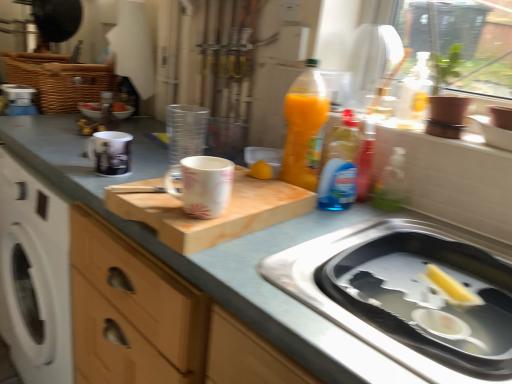
Measure the distance between point (39, 151) and camera.

The depth of point (39, 151) is 1.15 meters.

What do you see at coordinates (450, 288) in the screenshot?
I see `yellow rubber duck at sink right` at bounding box center [450, 288].

This screenshot has height=384, width=512. Describe the element at coordinates (106, 112) in the screenshot. I see `metallic silver bottle at upper center, which appears as the 1th bottle when viewed from the back` at that location.

Describe the element at coordinates (203, 185) in the screenshot. I see `pink floral ceramic mug at center, which ranks as the 1th mug in front-to-back order` at that location.

Locate an element on the screen. Image resolution: width=512 pixels, height=384 pixels. matte wooden cutting board at center is located at coordinates (214, 250).

From a real-world perspective, which is physically below, metallic silver bottle at upper center, marked as the 1th bottle in a top-to-bottom arrangement, or pink floral ceramic mug at center, which is counted as the 1th mug, starting from the right?

metallic silver bottle at upper center, marked as the 1th bottle in a top-to-bottom arrangement.

What's the angular difference between metallic silver bottle at upper center, positioned as the first bottle in left-to-right order, and pink floral ceramic mug at center, the second mug from the back,'s facing directions?

The angular difference between metallic silver bottle at upper center, positioned as the first bottle in left-to-right order, and pink floral ceramic mug at center, the second mug from the back, is 122 degrees.

Is metallic silver bottle at upper center, which ranks as the second bottle in front-to-back order, situated inside pink floral ceramic mug at center, which is counted as the 1th mug, starting from the right, or outside?

metallic silver bottle at upper center, which ranks as the second bottle in front-to-back order, is outside pink floral ceramic mug at center, which is counted as the 1th mug, starting from the right.

Is metallic silver bottle at upper center, positioned as the first bottle in left-to-right order, facing away from pink floral ceramic mug at center, which ranks as the 1th mug in front-to-back order?

No, metallic silver bottle at upper center, positioned as the first bottle in left-to-right order,'s orientation is not away from pink floral ceramic mug at center, which ranks as the 1th mug in front-to-back order.

Which of these two, wooden cutting board at center or matte white mug at upper left, the first mug when ordered from left to right, is wider?

With larger width is wooden cutting board at center.

Based on their positions, is wooden cutting board at center located to the left or right of matte white mug at upper left, which ranks as the first mug in back-to-front order?

wooden cutting board at center is to the right of matte white mug at upper left, which ranks as the first mug in back-to-front order.

Does point (210, 227) come behind point (123, 133)?

No, (210, 227) is in front of (123, 133).

From a real-world perspective, between wooden cutting board at center and matte white mug at upper left, which ranks as the first mug in back-to-front order, who is vertically higher?

matte white mug at upper left, which ranks as the first mug in back-to-front order, from a real-world perspective.

Where is `basket lying behind the matte wooden cutting board at center`? This screenshot has width=512, height=384. basket lying behind the matte wooden cutting board at center is located at coordinates (58, 79).

Looking at this image, how far apart are matte wooden cutting board at center and woven brown basket at upper left?

The distance of matte wooden cutting board at center from woven brown basket at upper left is 18.81 inches.

In the image, is matte wooden cutting board at center positioned in front of or behind woven brown basket at upper left?

Clearly, matte wooden cutting board at center is in front of woven brown basket at upper left.

What's the angular difference between matte wooden cutting board at center and woven brown basket at upper left's facing directions?

1.39 degrees.

Could you tell me if matte white mug at upper left, which is the 2th mug from front to back, is facing stainless steel sink at lower right?

Yes, matte white mug at upper left, which is the 2th mug from front to back, is aimed at stainless steel sink at lower right.

How many degrees apart are the facing directions of matte white mug at upper left, the second mug positioned from the right, and stainless steel sink at lower right?

matte white mug at upper left, the second mug positioned from the right, and stainless steel sink at lower right are facing 113 degrees away from each other.

Does point (102, 173) come in front of point (361, 332)?

No, it is behind (361, 332).

Between matte white mug at upper left, which is the 2th mug from front to back, and stainless steel sink at lower right, which one is positioned behind?

Positioned behind is matte white mug at upper left, which is the 2th mug from front to back.

In the image, is wooden cutting board at center positioned in front of or behind yellow rubber duck at sink right?

Visually, wooden cutting board at center is located in front of yellow rubber duck at sink right.

From the image's perspective, which is below, wooden cutting board at center or yellow rubber duck at sink right?

yellow rubber duck at sink right, from the image's perspective.

Is wooden cutting board at center located outside yellow rubber duck at sink right?

Yes, wooden cutting board at center is outside of yellow rubber duck at sink right.

Is wooden cutting board at center oriented away from yellow rubber duck at sink right?

wooden cutting board at center is not turned away from yellow rubber duck at sink right.

Find the location of a particular element. The image size is (512, 384). countertop that is below the matte white mug at upper left, the second mug positioned from the right (from the image's perspective) is located at coordinates (214, 250).

Is matte wooden cutting board at center situated inside matte white mug at upper left, the first mug when ordered from left to right, or outside?

matte wooden cutting board at center is located beyond the bounds of matte white mug at upper left, the first mug when ordered from left to right.

Are matte wooden cutting board at center and matte white mug at upper left, the first mug when ordered from left to right, far apart?

No, there isn't a large distance between matte wooden cutting board at center and matte white mug at upper left, the first mug when ordered from left to right.

Can you confirm if matte wooden cutting board at center is positioned to the left of matte white mug at upper left, the second mug positioned from the right?

Incorrect, matte wooden cutting board at center is not on the left side of matte white mug at upper left, the second mug positioned from the right.

Considering the relative positions of yellow rubber duck at sink right and wooden cutting board at center in the image provided, is yellow rubber duck at sink right to the right of wooden cutting board at center from the viewer's perspective?

Yes.

Considering the relative sizes of yellow rubber duck at sink right and wooden cutting board at center in the image provided, is yellow rubber duck at sink right thinner than wooden cutting board at center?

Indeed, yellow rubber duck at sink right has a lesser width compared to wooden cutting board at center.

From a real-world perspective, is yellow rubber duck at sink right beneath wooden cutting board at center?

Yes, from a real-world perspective, yellow rubber duck at sink right is below wooden cutting board at center.

Does yellow rubber duck at sink right have a lesser height compared to wooden cutting board at center?

Yes, yellow rubber duck at sink right is shorter than wooden cutting board at center.

Find the location of `bottle beneath the pink floral ceramic mug at center, which ranks as the 1th mug in front-to-back order (from a real-world perspective)`. bottle beneath the pink floral ceramic mug at center, which ranks as the 1th mug in front-to-back order (from a real-world perspective) is located at coordinates (106, 112).

This screenshot has width=512, height=384. Find the location of `cutting board below the matte white mug at upper left, which is the 2th mug from front to back (from the image's perspective)`. cutting board below the matte white mug at upper left, which is the 2th mug from front to back (from the image's perspective) is located at coordinates (211, 218).

Estimate the real-world distances between objects in this image. Which object is further from wooden cutting board at center, translucent plastic bottle at upper center, the 1th bottle viewed from the front, or yellow rubber duck at sink right?

yellow rubber duck at sink right is positioned further to the anchor wooden cutting board at center.

Looking at this image, which object lies nearer to the anchor point matte wooden cutting board at center, stainless steel sink at lower right or metallic silver bottle at upper center, the 2th bottle from the right?

stainless steel sink at lower right lies closer to matte wooden cutting board at center than the other object.

Looking at the image, which one is located further to matte wooden cutting board at center, metallic silver bottle at upper center, positioned as the first bottle in left-to-right order, or pink floral ceramic mug at center, the second mug from the back?

metallic silver bottle at upper center, positioned as the first bottle in left-to-right order, lies further to matte wooden cutting board at center than the other object.

From the image, which object appears to be farther from matte white mug at upper left, the first mug when ordered from left to right, pink floral ceramic mug at center, the 2th mug when ordered from left to right, or matte wooden cutting board at center?

pink floral ceramic mug at center, the 2th mug when ordered from left to right, is further to matte white mug at upper left, the first mug when ordered from left to right.

Estimate the real-world distances between objects in this image. Which object is further from stainless steel sink at lower right, woven brown basket at upper left or wooden cutting board at center?

woven brown basket at upper left lies further to stainless steel sink at lower right than the other object.

Based on their spatial positions, is wooden cutting board at center or pink floral ceramic mug at center, the second mug from the back, further from yellow rubber duck at sink right?

pink floral ceramic mug at center, the second mug from the back.

Considering their positions, is matte wooden cutting board at center positioned closer to stainless steel sink at lower right than metallic silver bottle at upper center, the second bottle positioned from the bottom?

matte wooden cutting board at center is closer to stainless steel sink at lower right.

Looking at the image, which one is located closer to pink floral ceramic mug at center, which is counted as the 1th mug, starting from the right, wooden cutting board at center or matte white mug at upper left, which is the 2th mug from front to back?

wooden cutting board at center lies closer to pink floral ceramic mug at center, which is counted as the 1th mug, starting from the right, than the other object.

At what (x,y) coordinates should I click in order to perform the action: click on cutting board between matte wooden cutting board at center and metallic silver bottle at upper center, which appears as the 1th bottle when viewed from the back, from front to back. Please return your answer as a coordinate pair (x, y). Image resolution: width=512 pixels, height=384 pixels. Looking at the image, I should click on (211, 218).

Where is `kitchen appliance between matte white mug at upper left, the second mug positioned from the right, and yellow rubber duck at sink right, in the horizontal direction`? Image resolution: width=512 pixels, height=384 pixels. kitchen appliance between matte white mug at upper left, the second mug positioned from the right, and yellow rubber duck at sink right, in the horizontal direction is located at coordinates (347, 310).

At what (x,y) coordinates should I click in order to perform the action: click on kitchen appliance located between matte wooden cutting board at center and translucent plastic bottle at upper center, the 2th bottle in the left-to-right sequence, in the depth direction. Please return your answer as a coordinate pair (x, y). Image resolution: width=512 pixels, height=384 pixels. Looking at the image, I should click on (347, 310).

Where is `bottle between metallic silver bottle at upper center, positioned as the first bottle in left-to-right order, and yellow rubber duck at sink right from left to right`? Image resolution: width=512 pixels, height=384 pixels. bottle between metallic silver bottle at upper center, positioned as the first bottle in left-to-right order, and yellow rubber duck at sink right from left to right is located at coordinates (340, 166).